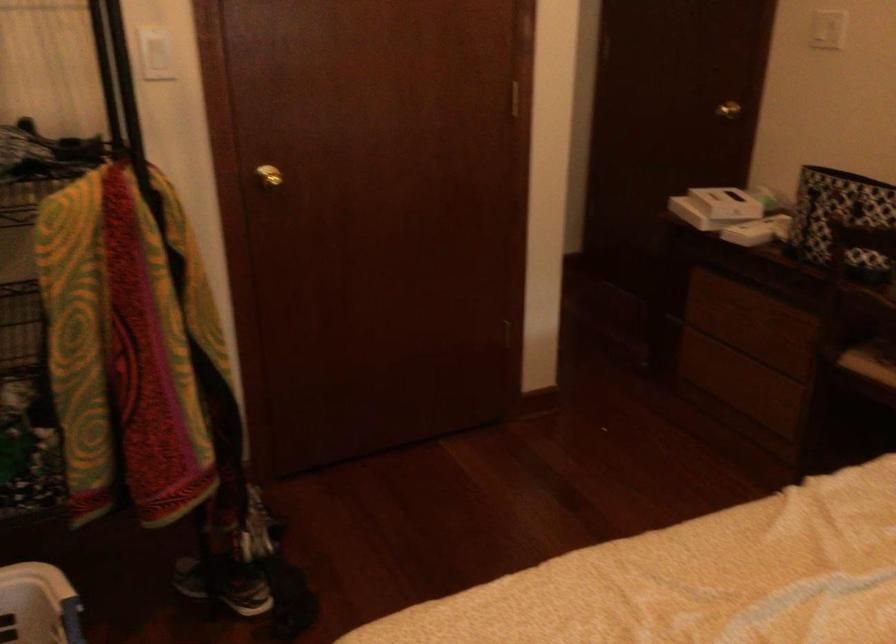
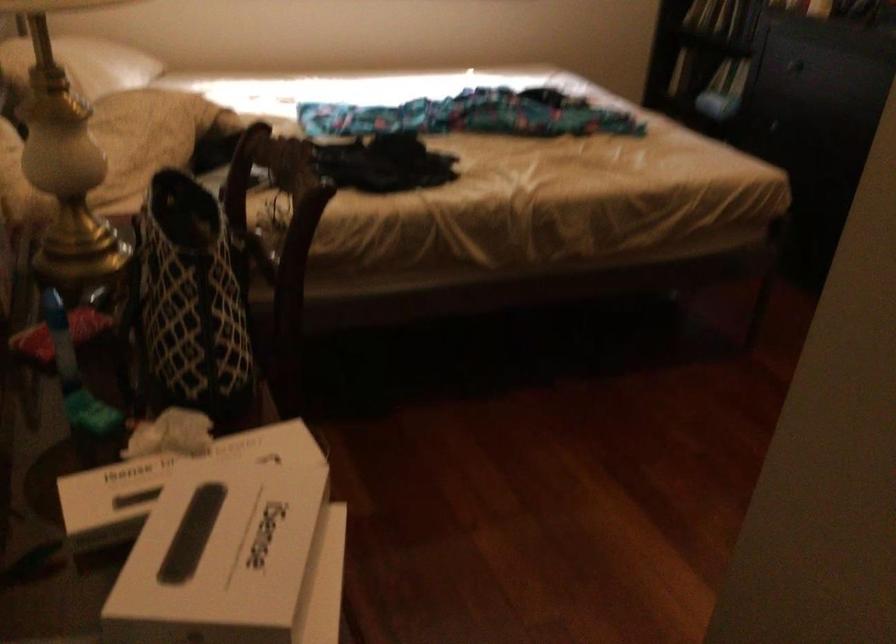
In the second image, find the point that corresponds to (702,190) in the first image.

(234, 560)